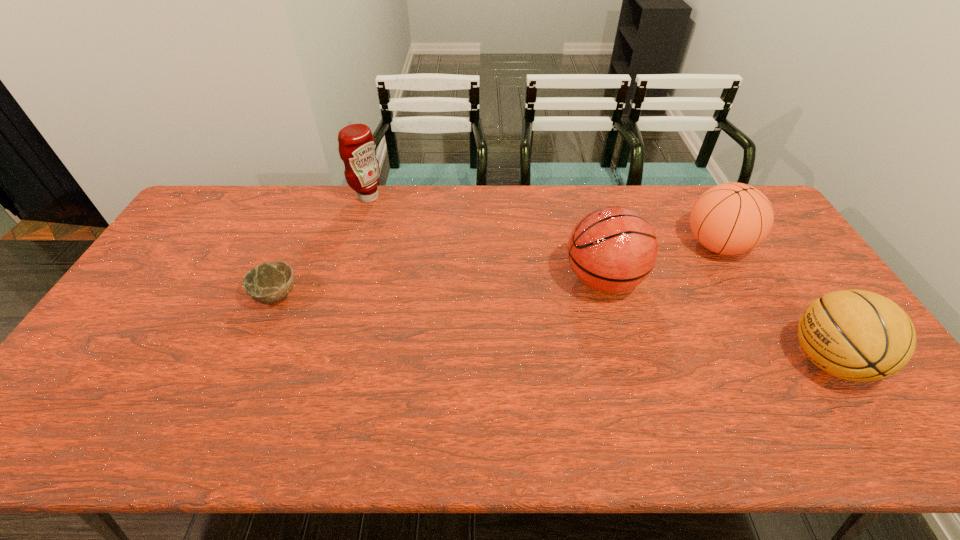
Identify which object is the nearest to the condiment. Please provide its 2D coordinates. Your answer should be formatted as a tuple, i.e. [(x, y)], where the tuple contains the x and y coordinates of a point satisfying the conditions above.

[(267, 283)]

Choose which basketball is the nearest neighbor to the leftmost basketball. Please provide its 2D coordinates. Your answer should be formatted as a tuple, i.e. [(x, y)], where the tuple contains the x and y coordinates of a point satisfying the conditions above.

[(732, 218)]

Locate which basketball is the closest to the third object from right to left. Please provide its 2D coordinates. Your answer should be formatted as a tuple, i.e. [(x, y)], where the tuple contains the x and y coordinates of a point satisfying the conditions above.

[(732, 218)]